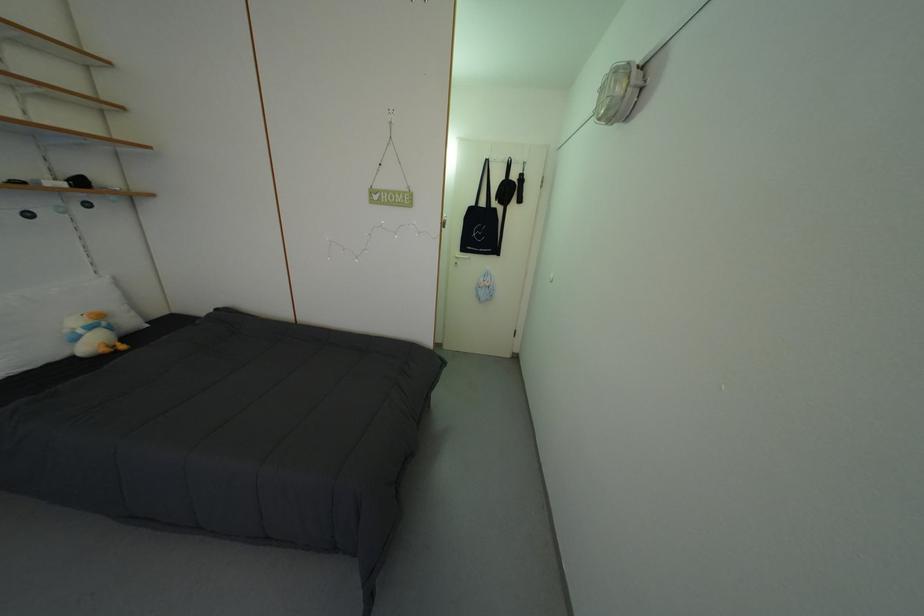
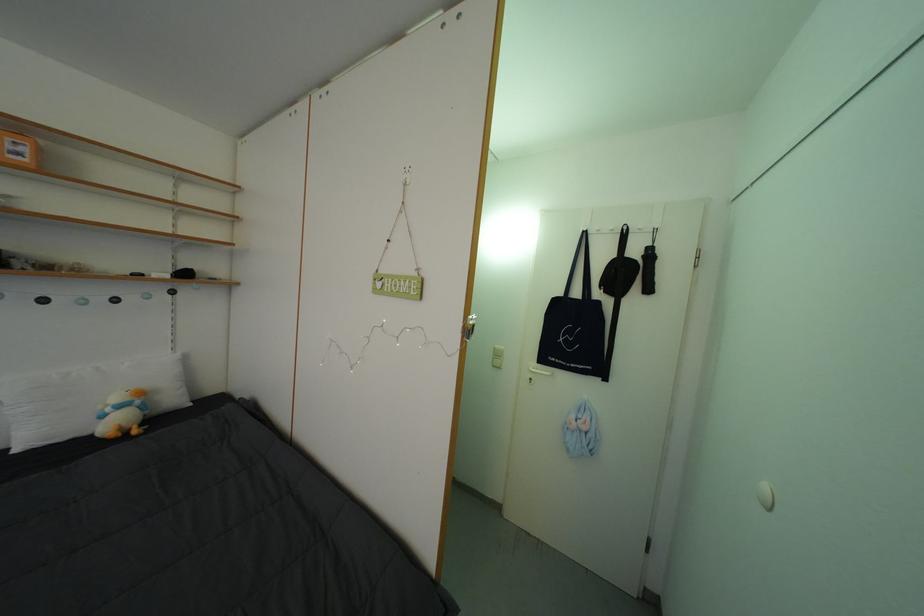
How did the camera likely rotate?

The camera's rotation is toward left-up.